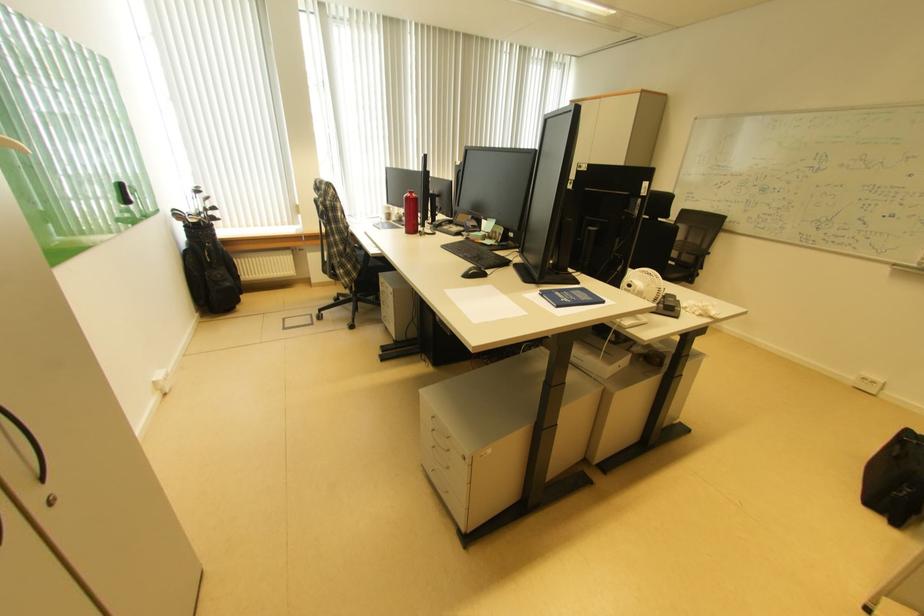
Where would you lift the black backpack? Please return your answer as a coordinate pair (x, y).

(895, 479)